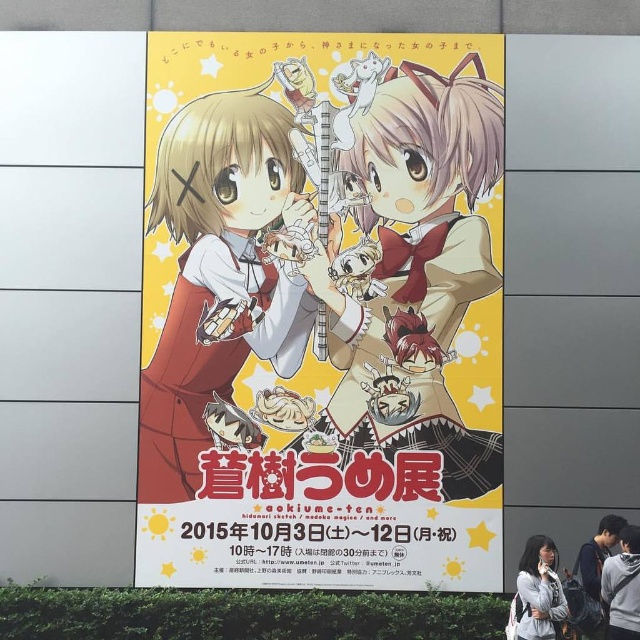
Question: Can you confirm if matte red dress at center is wider than gray hoodie at lower right?

Choices:
 (A) yes
 (B) no

Answer: (A)

Question: Which object is the farthest from the light gray fabric jacket at lower right?

Choices:
 (A) matte red dress at center
 (B) matte red dress at left
 (C) dark gray hoodie at lower right

Answer: (A)

Question: Which of the following is the closest to the observer?

Choices:
 (A) dark gray hoodie at lower right
 (B) matte red dress at center
 (C) gray hoodie at lower right
 (D) light gray fabric jacket at lower right

Answer: (D)

Question: Does matte red dress at center have a greater width compared to dark gray hoodie at lower right?

Choices:
 (A) no
 (B) yes

Answer: (B)

Question: Which point is closer to the camera?

Choices:
 (A) (429, 483)
 (B) (598, 621)
 (C) (634, 636)
 (D) (515, 611)

Answer: (C)

Question: Can you confirm if light gray fabric jacket at lower right is thinner than gray hoodie at lower right?

Choices:
 (A) yes
 (B) no

Answer: (B)